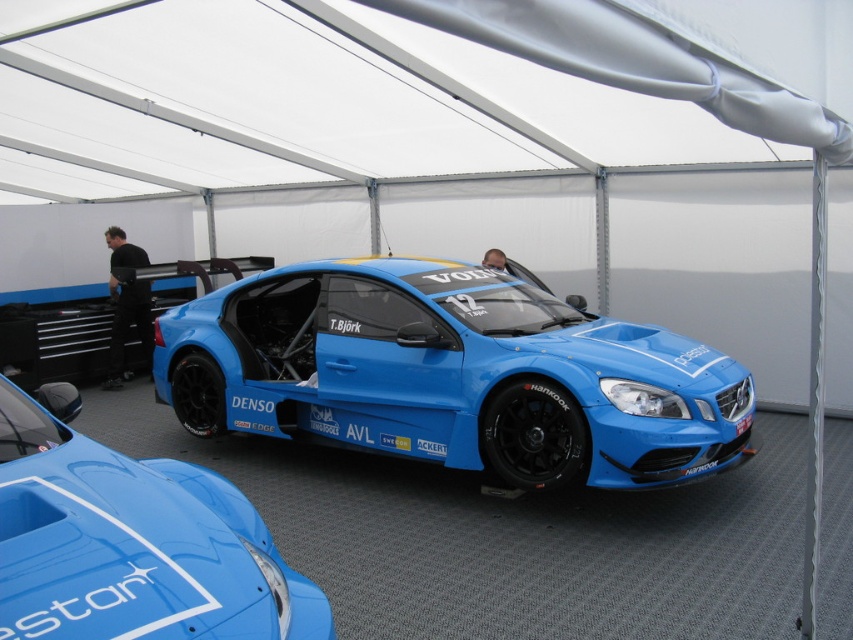
Is glossy blue race car at center taller than black fabric man at left?

Incorrect, glossy blue race car at center's height is not larger of black fabric man at left's.

Identify the location of glossy blue race car at center. The image size is (853, 640). (131, 541).

Can you confirm if matte blue race car at center is smaller than smooth skin face at center?

No, matte blue race car at center is not smaller than smooth skin face at center.

Is matte blue race car at center further to camera compared to smooth skin face at center?

That is False.

Is point (601, 445) positioned before point (483, 256)?

Yes, point (601, 445) is closer to viewer.

Find the location of `matte blue race car at center`. matte blue race car at center is located at coordinates (451, 374).

Can you confirm if matte blue race car at center is wider than glossy blue race car at center?

Indeed, matte blue race car at center has a greater width compared to glossy blue race car at center.

Can you confirm if matte blue race car at center is taller than glossy blue race car at center?

Yes.

Between point (612, 472) and point (189, 492), which one is positioned in front?

Point (189, 492) is in front.

Where is `matte blue race car at center`? Image resolution: width=853 pixels, height=640 pixels. matte blue race car at center is located at coordinates (451, 374).